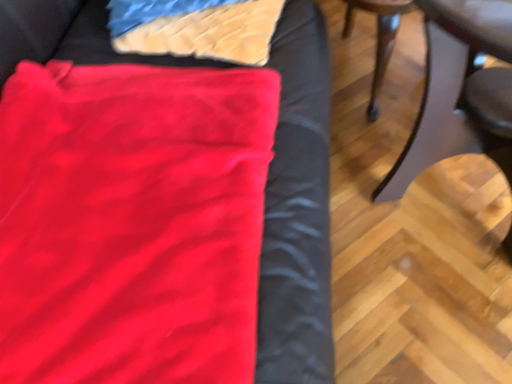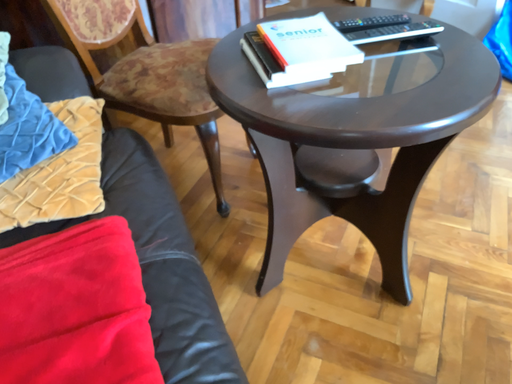
Question: How did the camera likely rotate when shooting the video?

Choices:
 (A) rotated downward
 (B) rotated upward

Answer: (B)